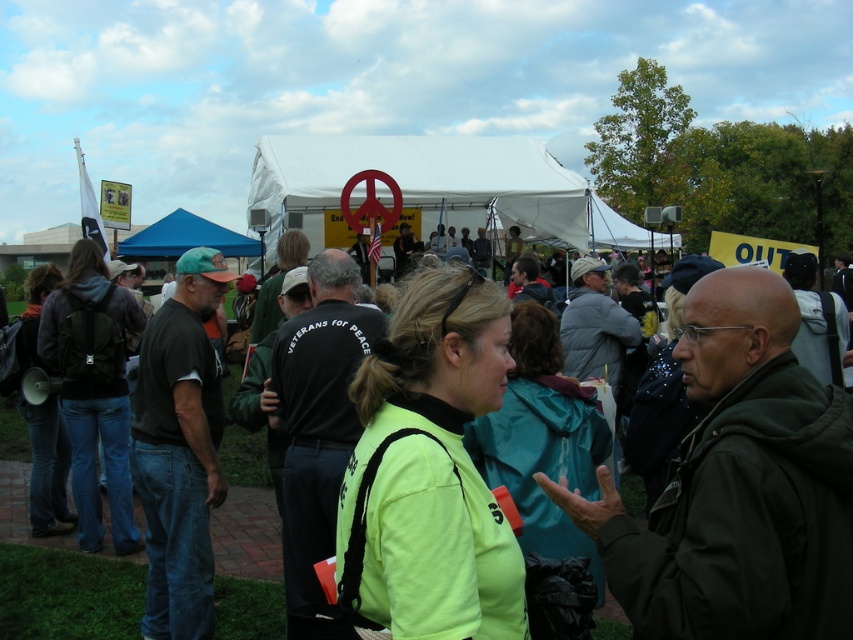
You are a photographer at the event. You want to take a photo of the white fabric tent at center without any people in the frame. Is the neon yellow jacket at center blocking the view of the tent?

The neon yellow jacket at center is behind the white fabric tent at center, so it is not blocking the view. You can take the photo without any obstruction.

Looking at this image, you are standing at the point marked as point [416,148] in the image. A friend is holding a megaphone 10 meters in front of you. Can you hear them clearly?

The distance between you and your friend holding the megaphone is 10 meters, which is within a typical effective range for a megaphone. Yes, you can hear them clearly.

You are at the center of the gathering and want to locate the neon yellow jacket at center. Based on the coordinates provided, in which direction should you look relative to your current position?

The neon yellow jacket at center is located at coordinates point (x=67, y=595), which would be to the lower right direction from your current position at the center.